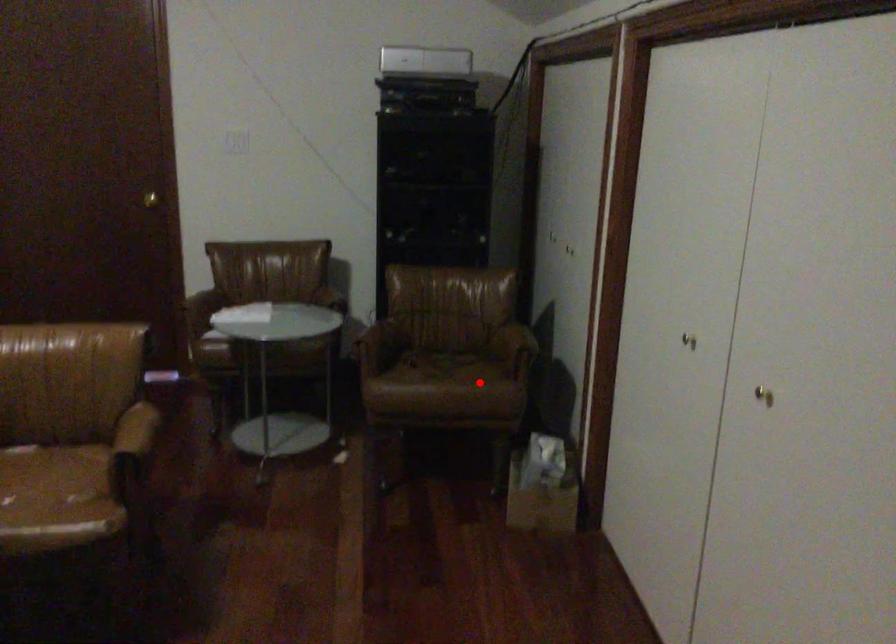
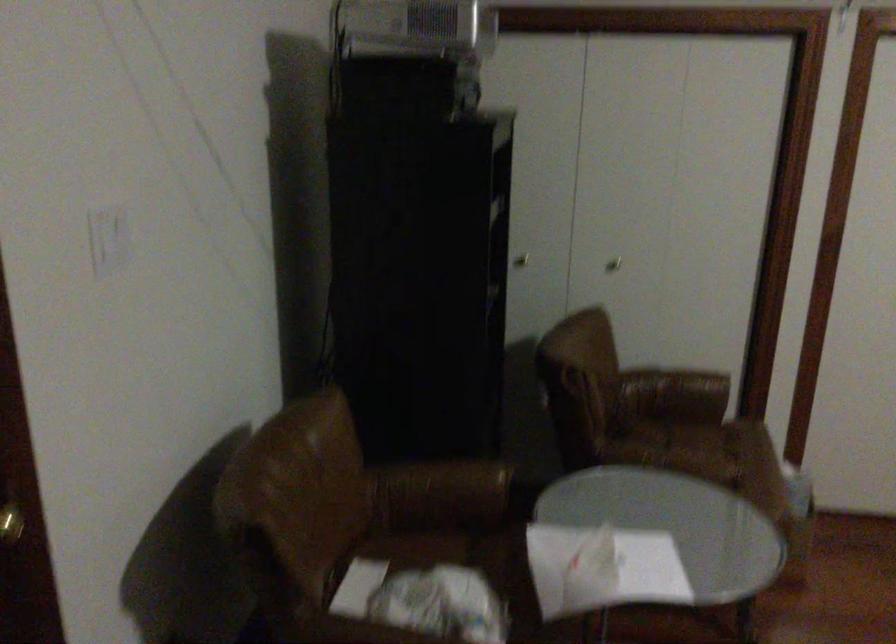
Question: A red point is marked in image1. In image2, is the corresponding 3D point closer to the camera or farther? Reply with the corresponding letter.

Choices:
 (A) The corresponding 3D point is closer.
 (B) The corresponding 3D point is farther.

Answer: (A)